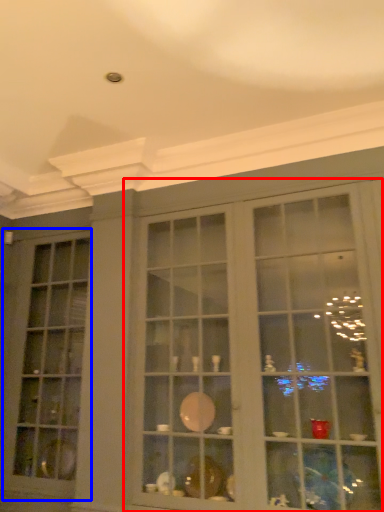
Question: Which of the following is the closest to the observer, shelf (highlighted by a red box) or window (highlighted by a blue box)?

Choices:
 (A) shelf
 (B) window

Answer: (A)